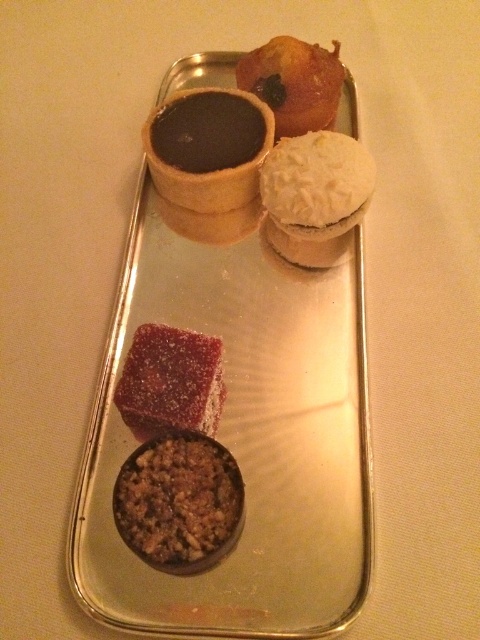
Does point (130, 465) come in front of point (271, 52)?

Yes.

Which is more to the right, brown crumbly at lower left or shiny chocolate tartlet at upper right?

shiny chocolate tartlet at upper right

Between point (167, 456) and point (328, 104), which one is positioned in front?

Point (167, 456) is in front.

The height and width of the screenshot is (640, 480). What are the coordinates of `brown crumbly at lower left` in the screenshot? It's located at (180, 502).

Is point (203, 332) in front of point (254, 116)?

Yes, it is in front of point (254, 116).

Looking at this image, who is more forward, (x=323, y=461) or (x=201, y=195)?

Point (x=323, y=461) is more forward.

Find the location of a particular element. This screenshot has width=480, height=640. shiny silver tray at center is located at coordinates (241, 442).

Which is behind, point (207, 528) or point (173, 387)?

The point (173, 387) is behind.

Which is in front, point (228, 472) or point (193, 428)?

Point (228, 472) is in front.

Find the location of a particular element. This screenshot has height=640, width=480. brown crumbly at lower left is located at coordinates (180, 502).